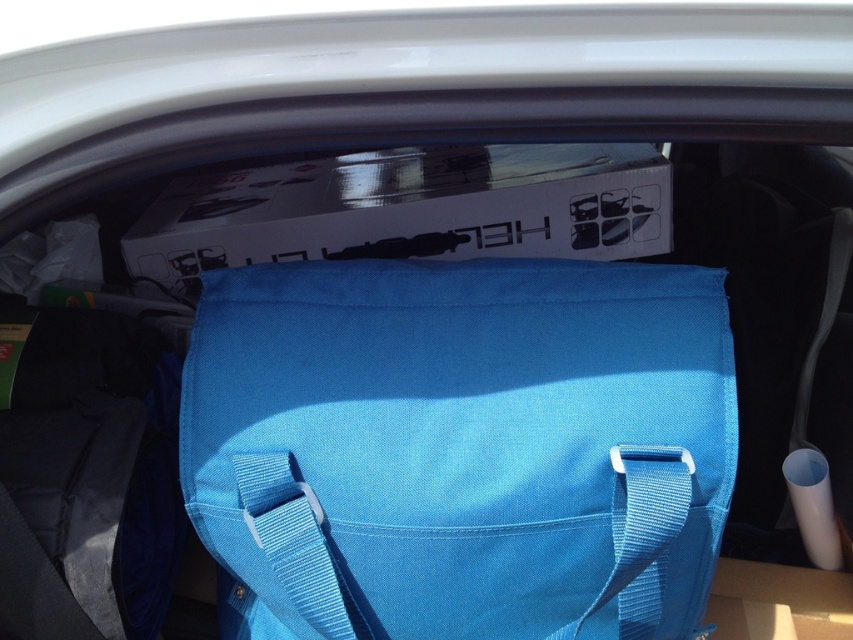
Question: Can you confirm if blue canvas bag at center is positioned above blue fabric strap at center?

Choices:
 (A) yes
 (B) no

Answer: (A)

Question: Which object is closer to the camera taking this photo?

Choices:
 (A) blue fabric strap at center
 (B) blue canvas bag at center

Answer: (A)

Question: Is blue canvas bag at center closer to camera compared to blue fabric strap at center?

Choices:
 (A) yes
 (B) no

Answer: (B)

Question: Does blue canvas bag at center have a larger size compared to blue fabric strap at center?

Choices:
 (A) yes
 (B) no

Answer: (A)

Question: Which point is closer to the camera taking this photo?

Choices:
 (A) (624, 548)
 (B) (503, 392)

Answer: (A)